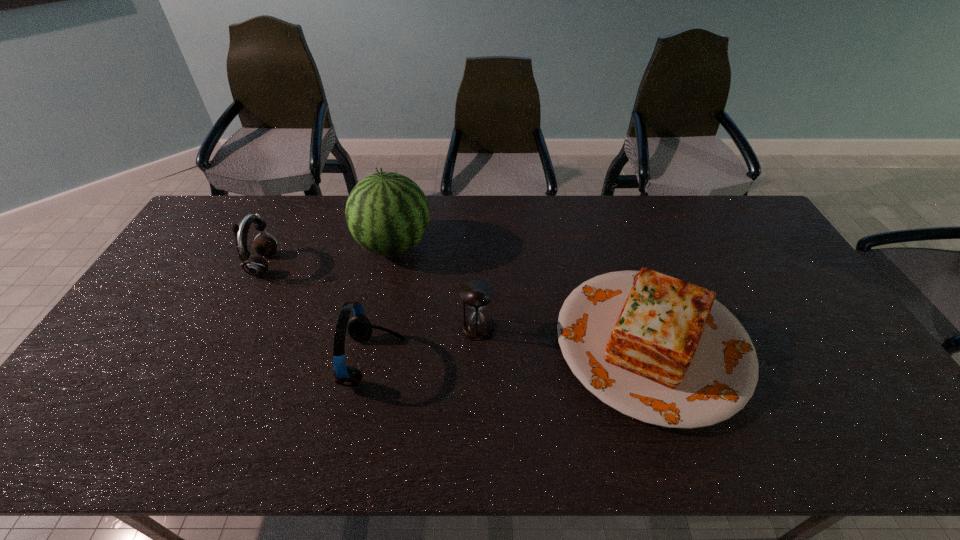
At what (x,y) coordinates should I click in order to perform the action: click on free space between the headset and the fourth object from left to right. Please return your answer as a coordinate pair (x, y). Looking at the image, I should click on (425, 345).

Locate an element on the screen. This screenshot has width=960, height=540. free space that is in between the headset and the leftmost object is located at coordinates (319, 313).

Identify the location of vacant space that's between the headset and the tallest object. The width and height of the screenshot is (960, 540). (384, 303).

Where is `empty location between the watermelon and the lasagna`? empty location between the watermelon and the lasagna is located at coordinates (522, 294).

Locate an element on the screen. This screenshot has height=540, width=960. free area in between the watermelon and the earphone is located at coordinates (328, 255).

The height and width of the screenshot is (540, 960). Find the location of `free space between the rightmost object and the headset`. free space between the rightmost object and the headset is located at coordinates (513, 352).

Identify which object is the second nearest to the watermelon. Please provide its 2D coordinates. Your answer should be formatted as a tuple, i.e. [(x, y)], where the tuple contains the x and y coordinates of a point satisfying the conditions above.

[(359, 328)]

Select which object appears as the third closest to the lasagna. Please provide its 2D coordinates. Your answer should be formatted as a tuple, i.e. [(x, y)], where the tuple contains the x and y coordinates of a point satisfying the conditions above.

[(359, 328)]

This screenshot has height=540, width=960. What are the coordinates of `blank space that satisfies the following two spatial constraints: 1. on the ear pads of the earphone; 2. on the left side of the rightmost object` in the screenshot? It's located at (225, 343).

Where is `free location that satisfies the following two spatial constraints: 1. on the ear pads of the lasagna; 2. on the right side of the leftmost object`? free location that satisfies the following two spatial constraints: 1. on the ear pads of the lasagna; 2. on the right side of the leftmost object is located at coordinates (225, 343).